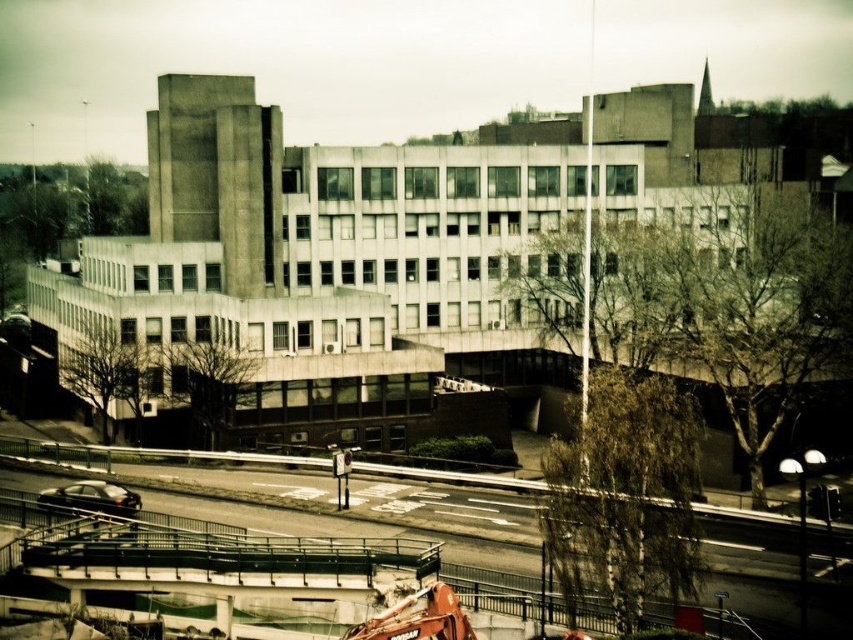
Question: Which point is farther to the camera?

Choices:
 (A) (358, 168)
 (B) (816, 605)

Answer: (A)

Question: Can you confirm if concrete at center is wider than orange metallic crane at center?

Choices:
 (A) yes
 (B) no

Answer: (A)

Question: Is concrete at center closer to the viewer compared to orange metallic crane at center?

Choices:
 (A) yes
 (B) no

Answer: (B)

Question: Which point is farther to the camera?

Choices:
 (A) (779, 605)
 (B) (164, 358)

Answer: (B)

Question: Can you confirm if concrete at center is smaller than orange metallic crane at center?

Choices:
 (A) no
 (B) yes

Answer: (A)

Question: Which point appears farthest from the camera in this image?

Choices:
 (A) (256, 394)
 (B) (172, 506)

Answer: (A)